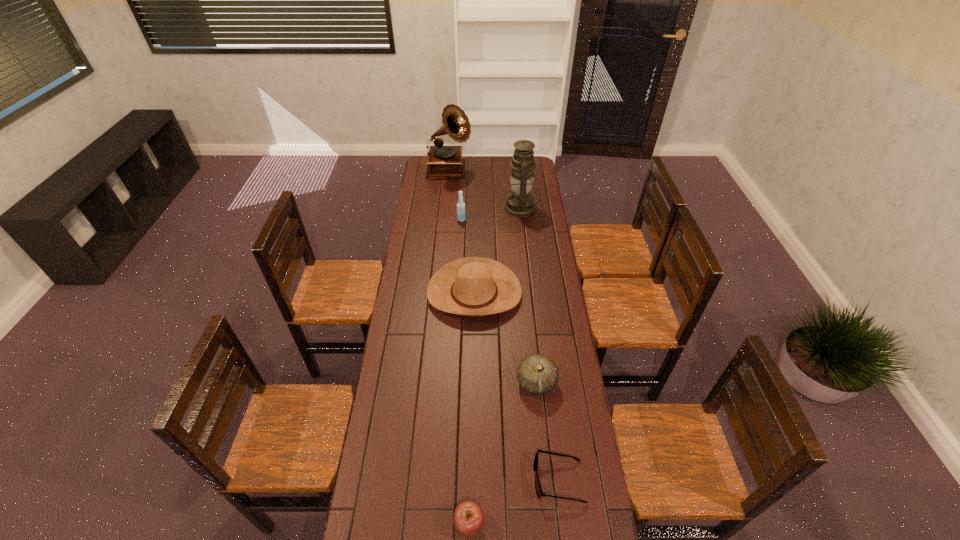
In order to click on free space located 0.250m on the front of the oil lamp in this screenshot , I will do `click(526, 253)`.

What are the coordinates of `free space located on the left of the third tallest object` in the screenshot? It's located at (417, 220).

Find the location of `free space located on the front-facing side of the cowboy hat`. free space located on the front-facing side of the cowboy hat is located at coordinates (473, 397).

The height and width of the screenshot is (540, 960). In order to click on vacant area located 0.340m on the left of the gourd in this screenshot , I will do `click(427, 382)`.

Where is `free space located on the front-facing side of the shortest object`? free space located on the front-facing side of the shortest object is located at coordinates (488, 480).

This screenshot has width=960, height=540. Find the location of `free spot located 0.330m on the front-facing side of the shortest object`. free spot located 0.330m on the front-facing side of the shortest object is located at coordinates (432, 480).

You are a GUI agent. You are given a task and a screenshot of the screen. Output one action in this format:
    pyautogui.click(x=<x>, y=<y>)
    Task: Click on the vacant space located on the front-facing side of the shortest object
    Image resolution: width=960 pixels, height=540 pixels.
    Given the screenshot: What is the action you would take?
    pyautogui.click(x=457, y=480)

Identify the location of object present at the far edge. (444, 162).

The image size is (960, 540). I want to click on record player that is positioned at the left edge, so click(444, 162).

In order to click on cowboy hat present at the left edge in this screenshot , I will do click(x=474, y=286).